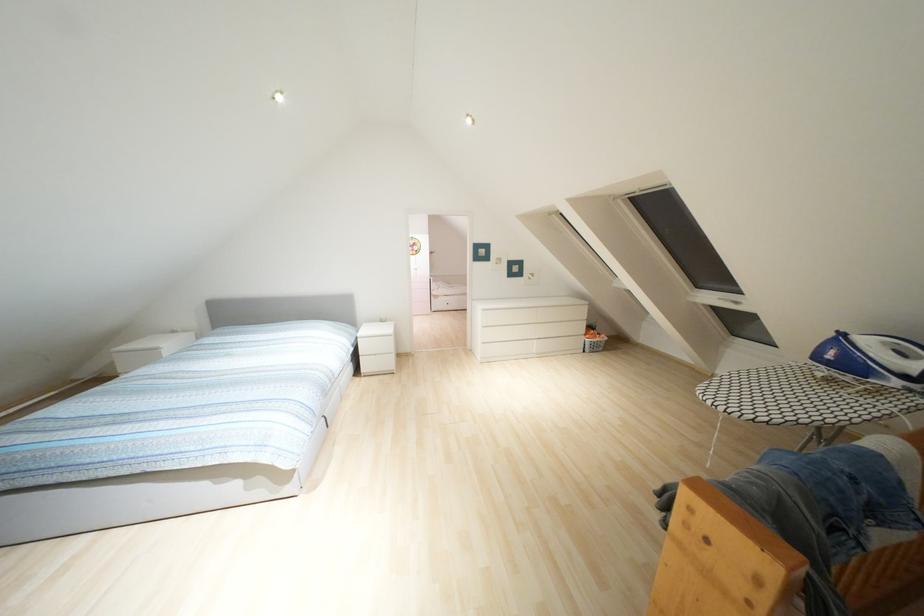
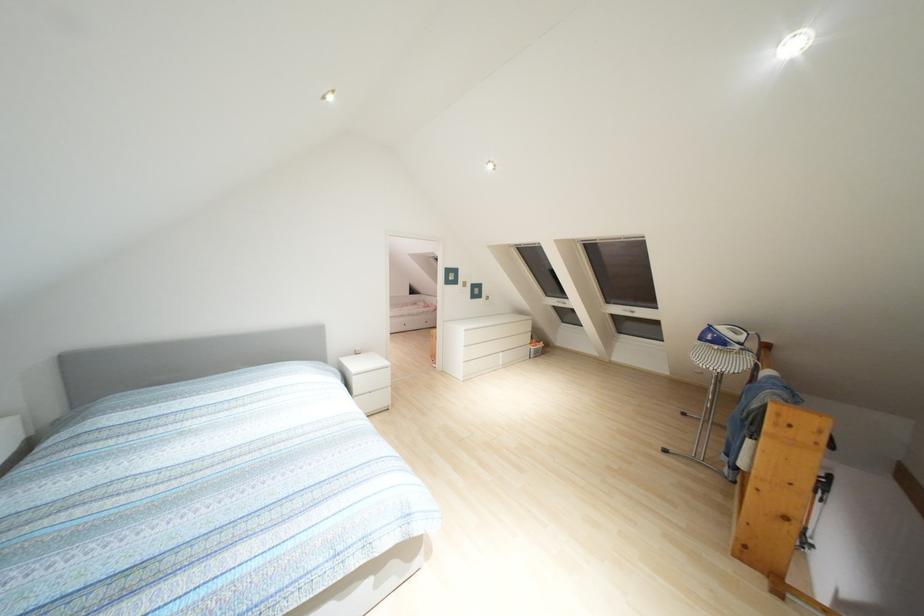
Question: Which direction would the cameraman need to move to produce the second image? Reply with the corresponding letter.

Choices:
 (A) Left
 (B) Right
 (C) Forward
 (D) Backward

Answer: (A)